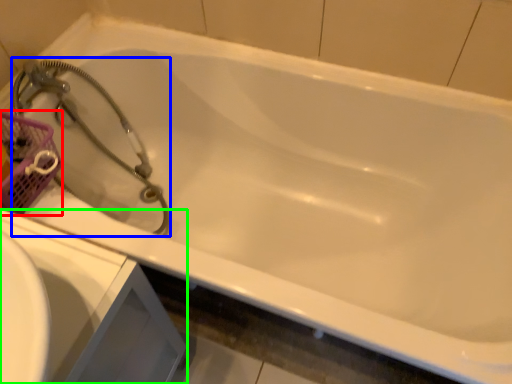
Question: Which object is positioned closest to basket (highlighted by a red box)? Select from garden hose (highlighted by a blue box) and sink (highlighted by a green box).

Choices:
 (A) garden hose
 (B) sink

Answer: (A)